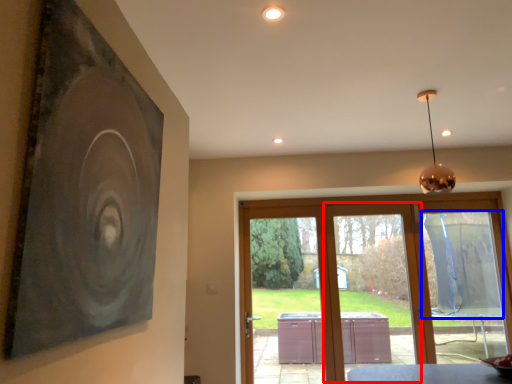
Question: Which object appears farthest to the camera in this image, screen door (highlighted by a red box) or window screen (highlighted by a blue box)?

Choices:
 (A) screen door
 (B) window screen

Answer: (A)